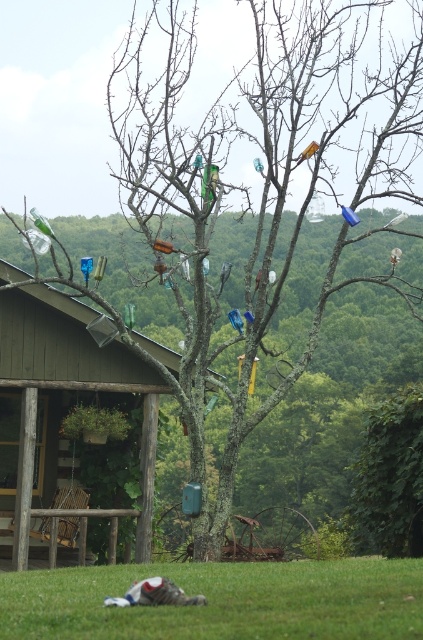
You are planning to set up a small garden in the area shown in the image. You have two options for placement based on the objects present. The first option is to place it on the green grass at lower center, and the second is near the wooden porch swing at left. Considering the height differences between these two areas, which location would be more level for your garden setup?

The green grass at lower center has a lesser height compared to the wooden porch swing at left, so the green grass at lower center would be more level for the garden setup.

You are standing in the rustic outdoor scene and want to place a 7 meter long ladder from the green grass at lower center to the tree with hanging bottles. Is the distance sufficient?

The green grass at lower center is 6.95 meters from viewer. The ladder is 7 meters long, so it may not reach as the distance is slightly shorter than the ladder.